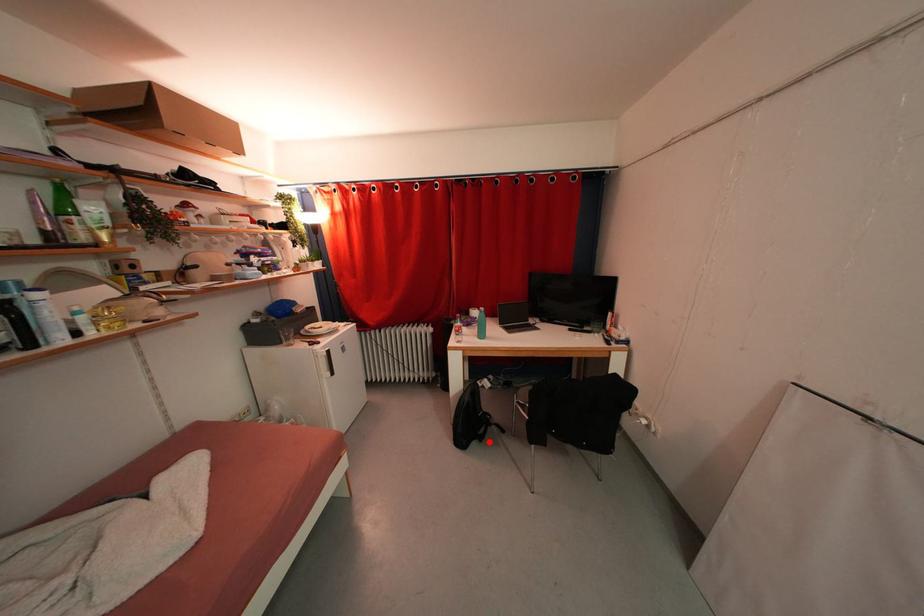
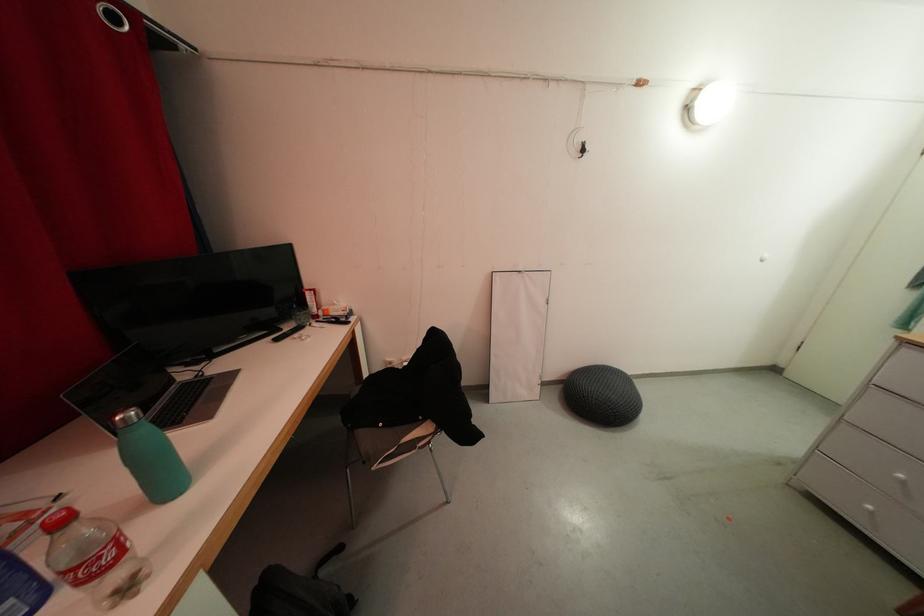
Question: I am providing you with two images of the same scene from different viewpoints. A red point is shown in image1. For the corresponding object point in image2, is it positioned nearer or farther from the camera?

Choices:
 (A) Nearer
 (B) Farther

Answer: (A)